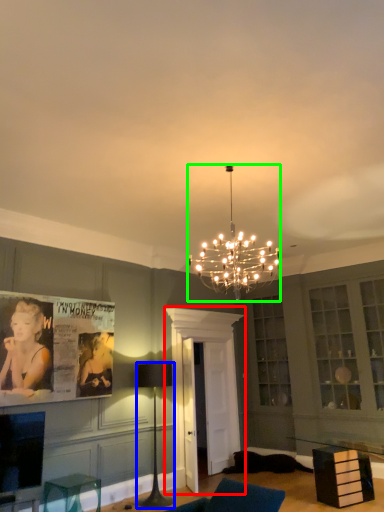
Question: Which object is positioned closest to glass door (highlighted by a red box)? Select from lamp (highlighted by a blue box) and lamp (highlighted by a green box).

Choices:
 (A) lamp
 (B) lamp

Answer: (A)